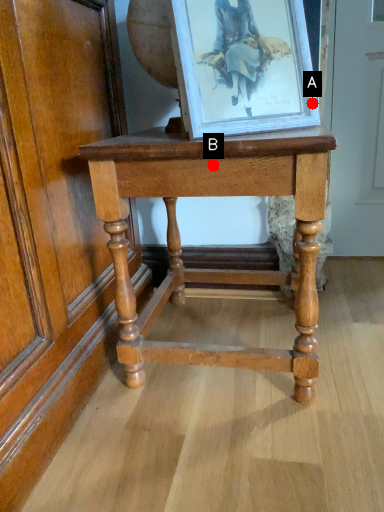
Question: Two points are circled on the image, labeled by A and B beside each circle. Which point is further to the camera?

Choices:
 (A) A is further
 (B) B is further

Answer: (A)